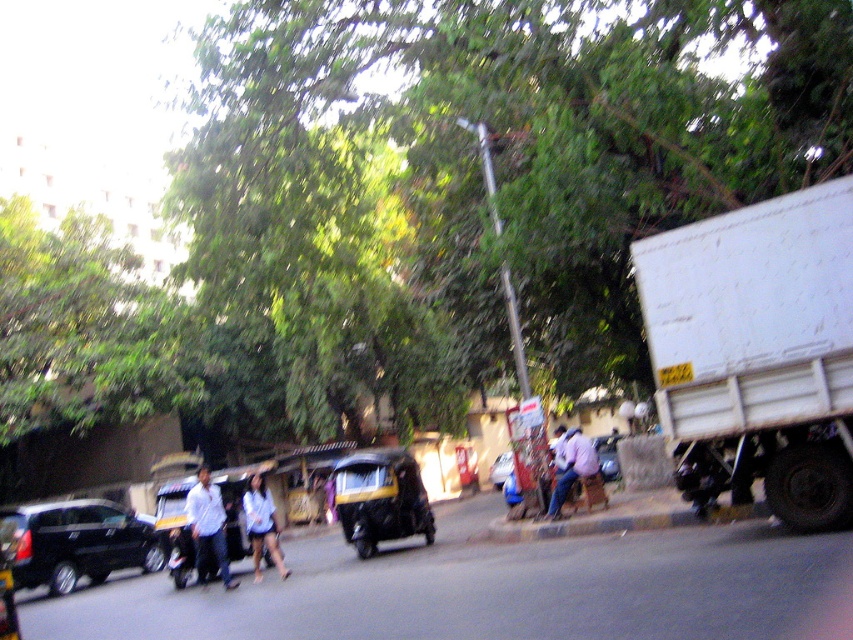
You are standing at the point marked by the coordinates point (x=260, y=525). Looking around, you see a black auto rickshaw moving from left to right and two pedestrians on the left side. Which direction should you move to reach the light blue shirt at center without crossing the road?

The point (x=260, y=525) is on the light blue shirt at center, so you are already at the location of the light blue shirt at center. No movement is needed.

You are a delivery person standing at the starting point of your route. You need to reach a delivery location marked by point (x=201, y=548). There is an obstacle at point (x=537, y=220). Can you safely go around the obstacle without getting too close to it?

Point (x=537, y=220) is closer to the viewer than point (x=201, y=548), so you can safely go around the obstacle by moving further away from the obstacle towards the delivery location.